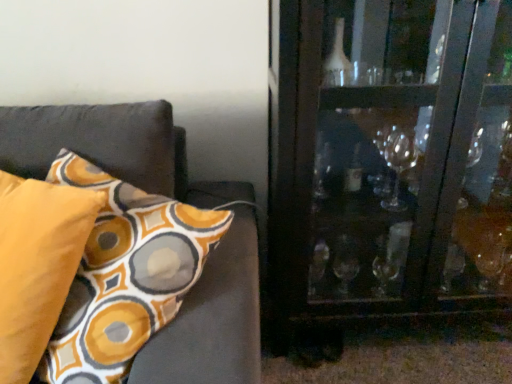
What do you see at coordinates (111, 147) in the screenshot? This screenshot has height=384, width=512. I see `textured fabric pillow at left` at bounding box center [111, 147].

I want to click on textured fabric pillow at left, so click(111, 147).

What is the approximate height of textured fabric pillow at left?

textured fabric pillow at left is 25.70 inches in height.

Where is `textured fabric pillow at left`? The width and height of the screenshot is (512, 384). textured fabric pillow at left is located at coordinates (111, 147).